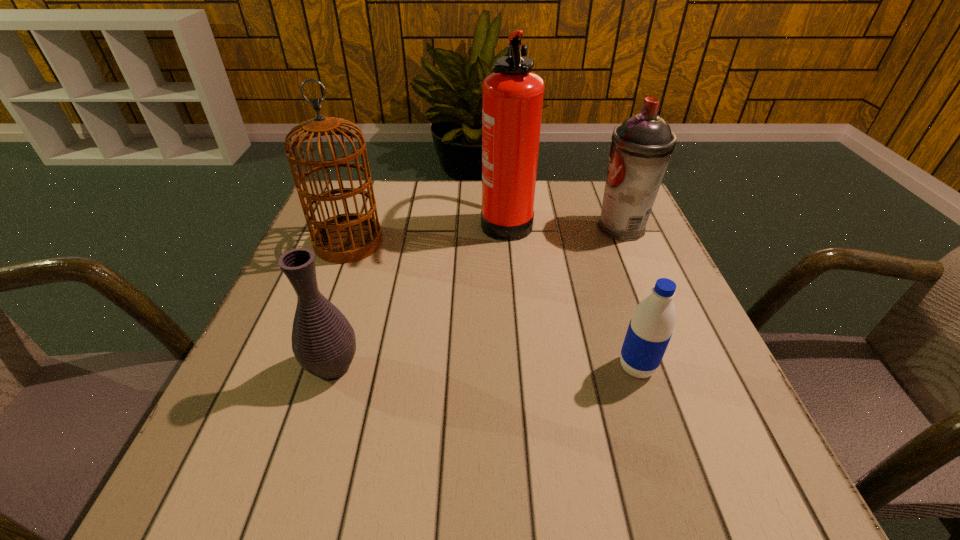
This screenshot has width=960, height=540. I want to click on free space that satisfies the following two spatial constraints: 1. at the nozzle of the water bottle; 2. on the left side of the tallest object, so click(518, 367).

Where is `free location that satisfies the following two spatial constraints: 1. at the nozzle of the third object from right to left; 2. on the right side of the third tallest object`? free location that satisfies the following two spatial constraints: 1. at the nozzle of the third object from right to left; 2. on the right side of the third tallest object is located at coordinates (507, 227).

This screenshot has width=960, height=540. I want to click on blank area in the image that satisfies the following two spatial constraints: 1. on the back side of the aerosol can; 2. on the right side of the vase, so click(x=376, y=227).